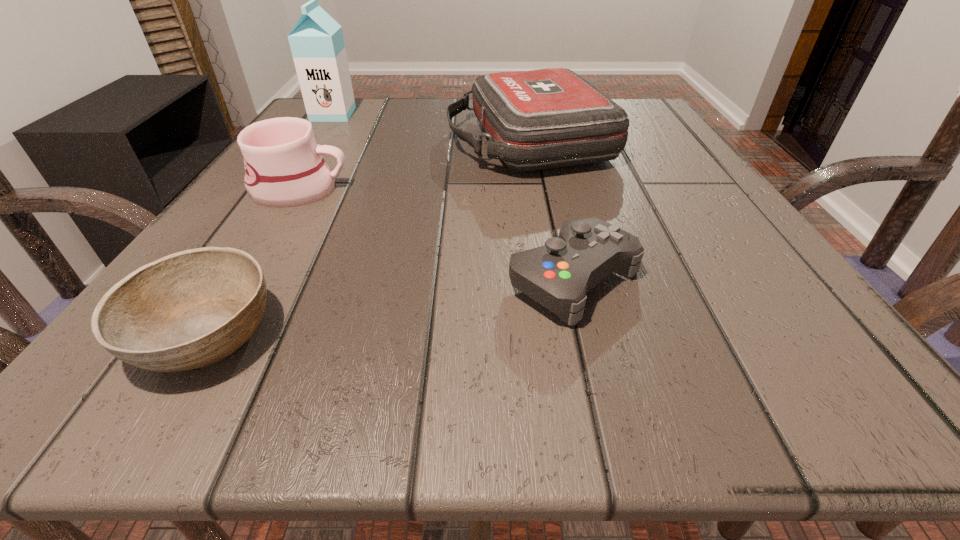
Where is `free spot that satisfies the following two spatial constraints: 1. on the back side of the bowl; 2. on the left side of the control`? free spot that satisfies the following two spatial constraints: 1. on the back side of the bowl; 2. on the left side of the control is located at coordinates (238, 280).